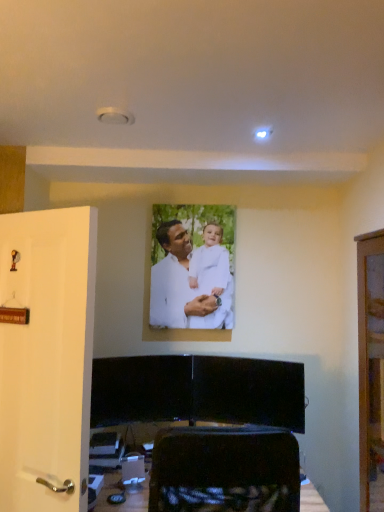
Question: Based on their positions, is white matte door at left located to the left or right of white matte portrait at center?

Choices:
 (A) right
 (B) left

Answer: (B)

Question: From the image's perspective, is white matte door at left located above or below white matte portrait at center?

Choices:
 (A) above
 (B) below

Answer: (B)

Question: Does point (84, 308) appear closer or farther from the camera than point (211, 274)?

Choices:
 (A) closer
 (B) farther

Answer: (A)

Question: From the image's perspective, relative to white matte door at left, is white matte portrait at center above or below?

Choices:
 (A) above
 (B) below

Answer: (A)

Question: Considering the relative positions of white matte portrait at center and white matte door at left in the image provided, is white matte portrait at center to the left or to the right of white matte door at left?

Choices:
 (A) right
 (B) left

Answer: (A)

Question: Is point (155, 285) closer or farther from the camera than point (66, 323)?

Choices:
 (A) farther
 (B) closer

Answer: (A)

Question: From their relative heights in the image, would you say white matte portrait at center is taller or shorter than white matte door at left?

Choices:
 (A) tall
 (B) short

Answer: (B)